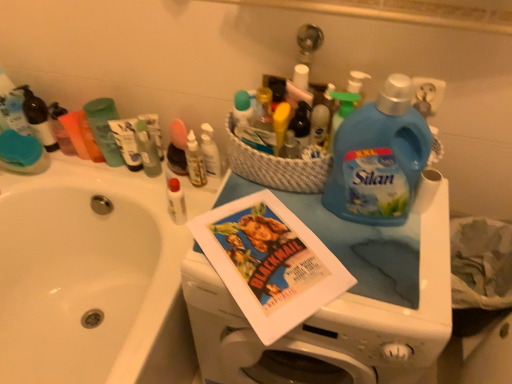
Where is `free space that is to the left of white paper at right`? The height and width of the screenshot is (384, 512). free space that is to the left of white paper at right is located at coordinates (347, 231).